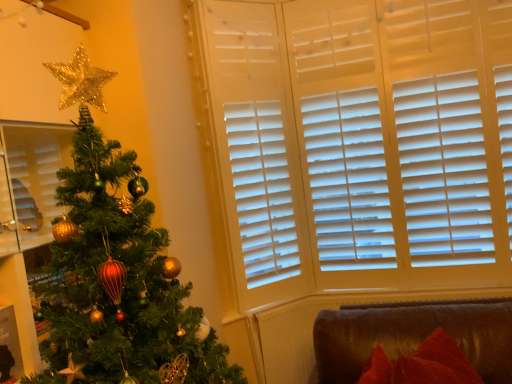
Question: From their relative heights in the image, would you say velvet red cushion at lower right is taller or shorter than shiny green christmas tree at left?

Choices:
 (A) tall
 (B) short

Answer: (B)

Question: Relative to shiny green christmas tree at left, is velvet red cushion at lower right in front or behind?

Choices:
 (A) behind
 (B) front

Answer: (A)

Question: Based on their sizes in the image, would you say velvet red cushion at lower right is bigger or smaller than shiny green christmas tree at left?

Choices:
 (A) small
 (B) big

Answer: (A)

Question: Considering the positions of shiny green christmas tree at left and velvet red cushion at lower right in the image, is shiny green christmas tree at left wider or thinner than velvet red cushion at lower right?

Choices:
 (A) wide
 (B) thin

Answer: (A)

Question: From their relative heights in the image, would you say shiny green christmas tree at left is taller or shorter than velvet red cushion at lower right?

Choices:
 (A) short
 (B) tall

Answer: (B)

Question: From the image's perspective, is shiny green christmas tree at left above or below velvet red cushion at lower right?

Choices:
 (A) above
 (B) below

Answer: (A)

Question: Based on their sizes in the image, would you say shiny green christmas tree at left is bigger or smaller than velvet red cushion at lower right?

Choices:
 (A) small
 (B) big

Answer: (B)